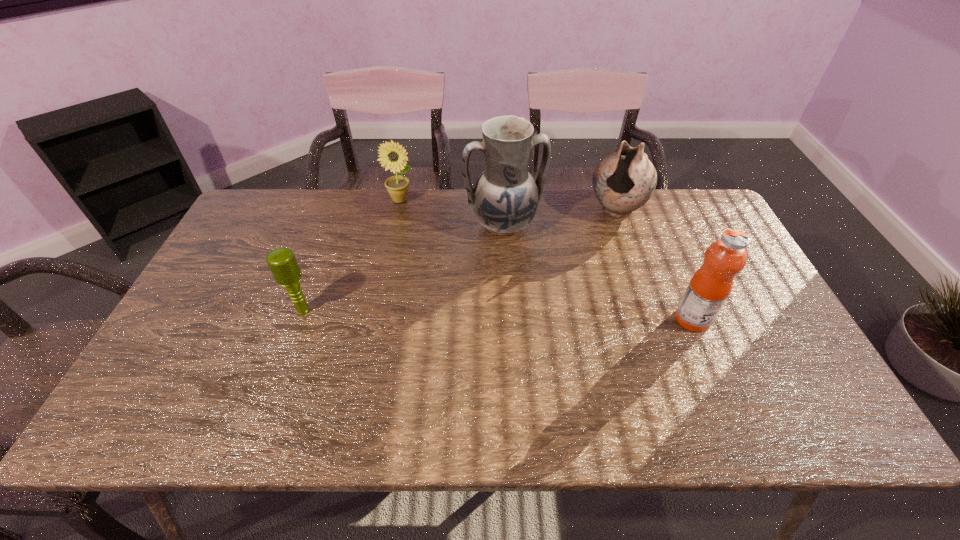
Locate an element on the screen. vacant area at the far edge is located at coordinates (647, 231).

In the image, there is a desktop. Where is `vacant space at the near edge`? This screenshot has width=960, height=540. vacant space at the near edge is located at coordinates (461, 375).

Locate an element on the screen. The image size is (960, 540). blank space at the left edge of the desktop is located at coordinates (220, 264).

Where is `blank space at the right edge of the desktop`? The height and width of the screenshot is (540, 960). blank space at the right edge of the desktop is located at coordinates (695, 259).

Where is `free region at the far left corner of the desktop`? The width and height of the screenshot is (960, 540). free region at the far left corner of the desktop is located at coordinates (263, 206).

In the image, there is a desktop. Identify the location of vacant space at the near left corner. This screenshot has height=540, width=960. (142, 383).

Where is `vacant region at the near right corner of the desktop`? Image resolution: width=960 pixels, height=540 pixels. vacant region at the near right corner of the desktop is located at coordinates (806, 392).

Where is `free space between the fruit juice and the pottery`? The height and width of the screenshot is (540, 960). free space between the fruit juice and the pottery is located at coordinates (655, 265).

This screenshot has width=960, height=540. Find the location of `free space that is in between the pottery and the leftmost object`. free space that is in between the pottery and the leftmost object is located at coordinates (460, 261).

Where is `free spot between the microphone and the sunflower`? free spot between the microphone and the sunflower is located at coordinates (351, 255).